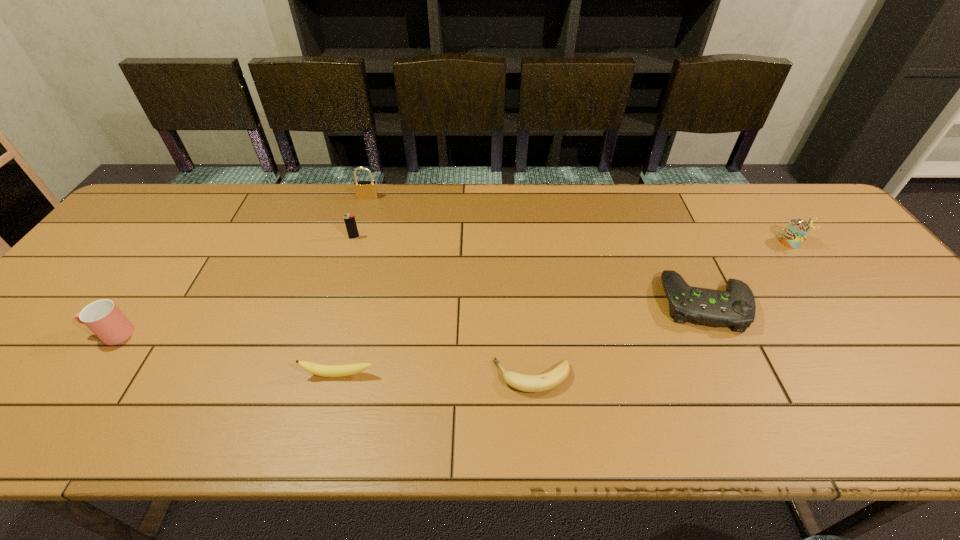
You are a GUI agent. You are given a task and a screenshot of the screen. Output one action in this format:
    pyautogui.click(x=<x>, y=<y>)
    Task: Click on the farthest object
    
    Given the screenshot: What is the action you would take?
    click(367, 190)

The image size is (960, 540). What are the coordinates of `the rightmost object` in the screenshot? It's located at (797, 230).

This screenshot has width=960, height=540. Find the location of `igniter`. igniter is located at coordinates (349, 220).

At what (x,y) coordinates should I click in order to perform the action: click on cup. Please return your answer as a coordinate pair (x, y). Looking at the image, I should click on (102, 317).

This screenshot has width=960, height=540. Identify the location of the second object from right to left. (735, 307).

Locate an element on the screen. Image resolution: width=960 pixels, height=540 pixels. the left banana is located at coordinates (317, 369).

Where is `the right banana`? The image size is (960, 540). the right banana is located at coordinates (528, 383).

The image size is (960, 540). Find the location of `the shorter banana`. the shorter banana is located at coordinates (528, 383).

Locate an element on the screen. Image resolution: width=960 pixels, height=540 pixels. vacant area situated on the front-facing side of the padlock is located at coordinates pyautogui.click(x=345, y=275).

Locate an element on the screen. Image resolution: width=960 pixels, height=540 pixels. vacant area situated 0.210m on the back of the can is located at coordinates (755, 192).